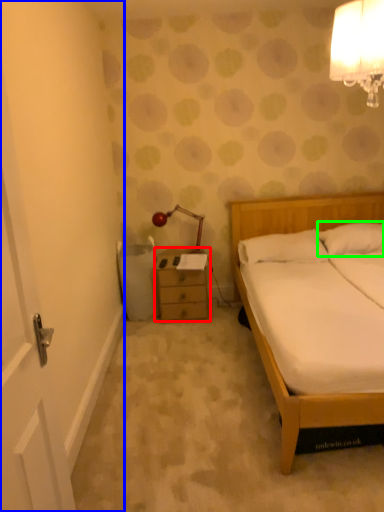
Question: Which object is positioned farthest from chest of drawers (highlighted by a red box)? Select from door (highlighted by a blue box) and pillow (highlighted by a green box).

Choices:
 (A) door
 (B) pillow

Answer: (B)